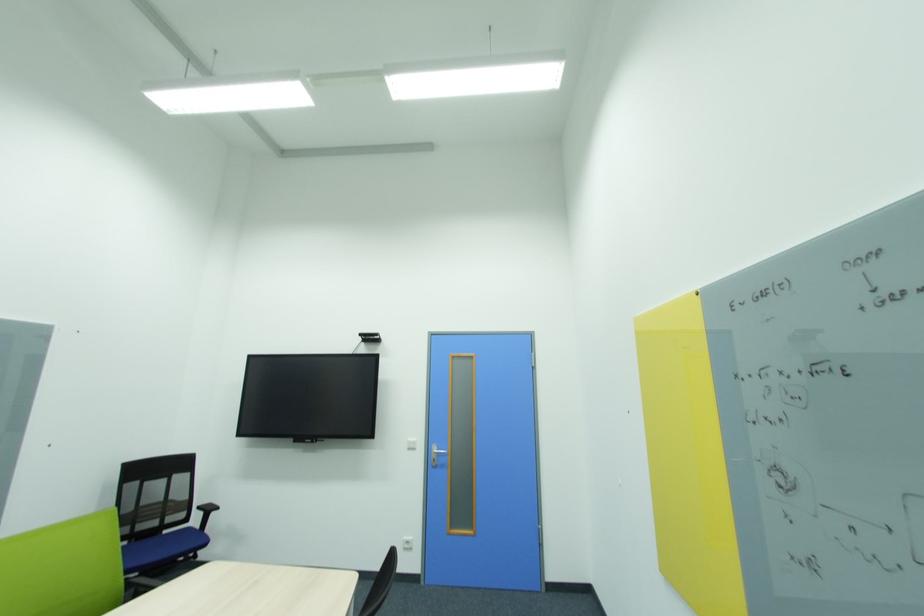
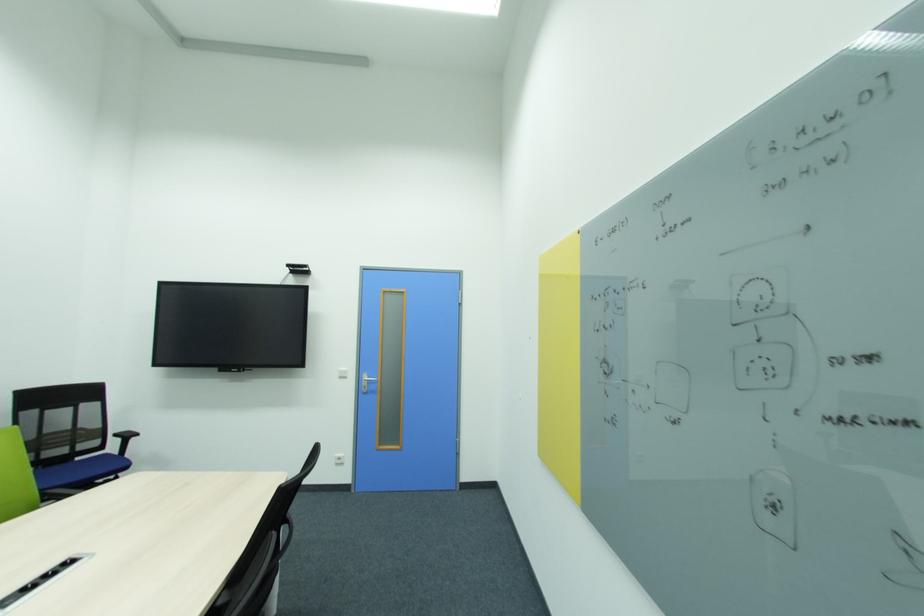
Question: The first image is from the beginning of the video and the second image is from the end. How did the camera likely rotate when shooting the video?

Choices:
 (A) Left
 (B) Right
 (C) Up
 (D) Down

Answer: (B)